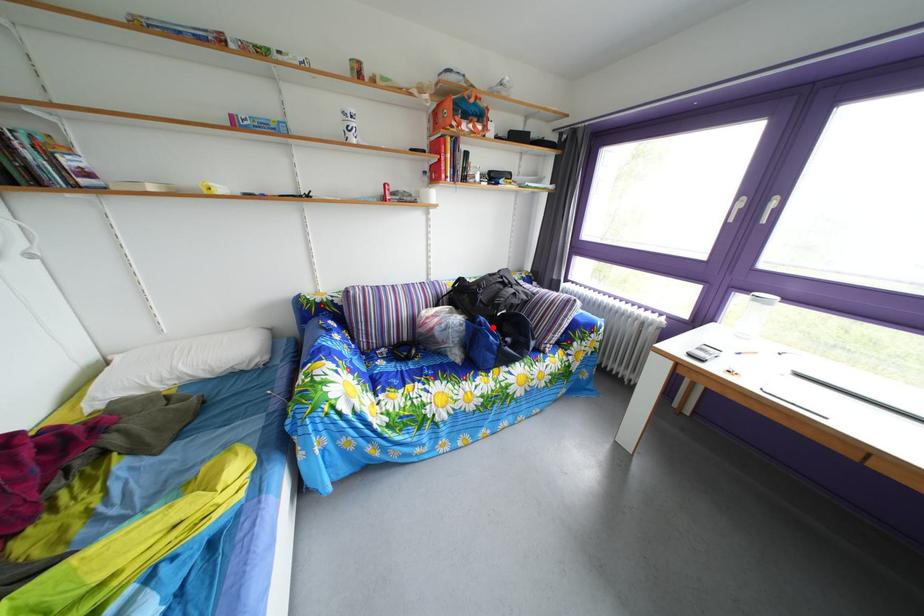
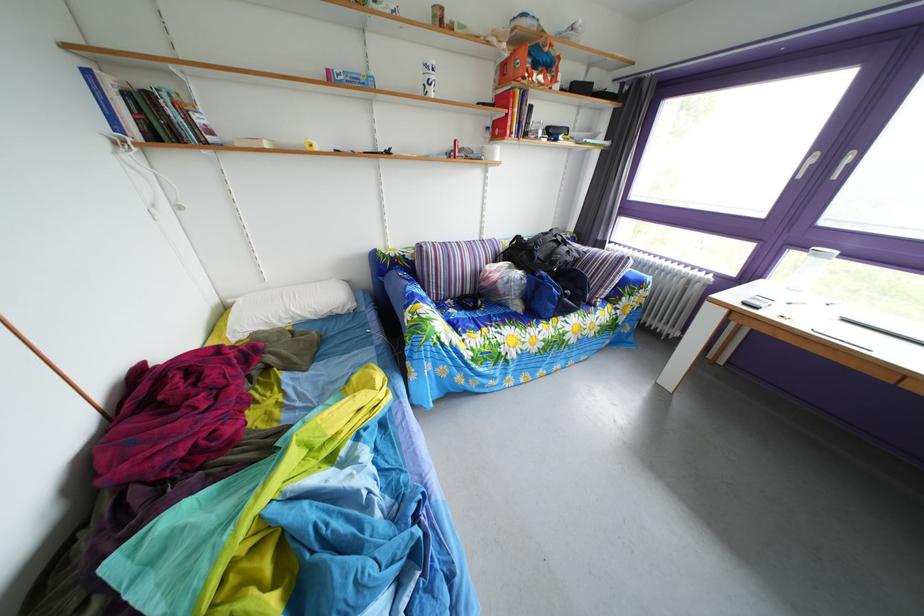
Question: I am providing you with two images of the same scene from different viewpoints. A red point is marked on the first image. Is the red point's position out of view in image 2?

Choices:
 (A) Yes
 (B) No

Answer: (B)